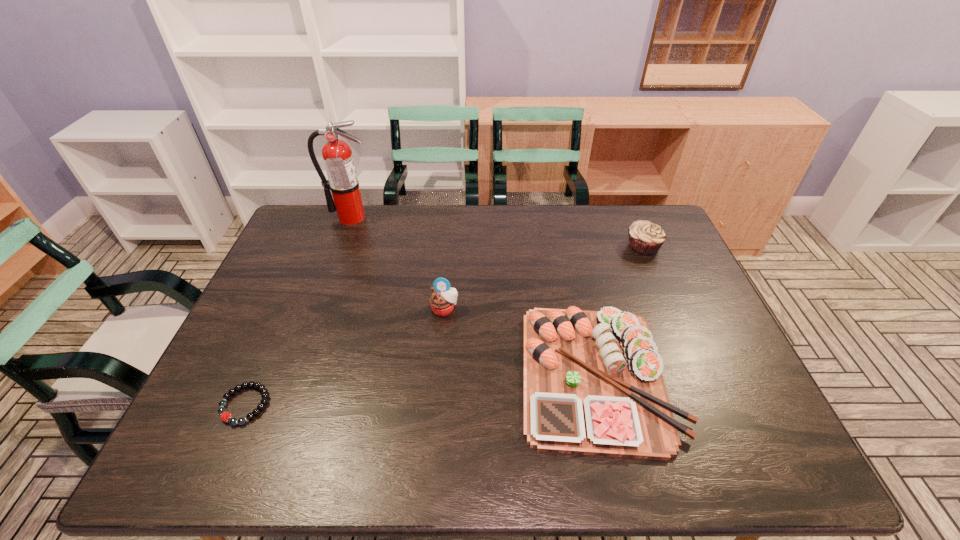
Where is `fire extinguisher`? The width and height of the screenshot is (960, 540). fire extinguisher is located at coordinates (337, 155).

Locate an element on the screen. This screenshot has height=540, width=960. the tallest object is located at coordinates (337, 155).

You are a GUI agent. You are given a task and a screenshot of the screen. Output one action in this format:
    pyautogui.click(x=<x>, y=<y>)
    Task: Click on the nearer muffin
    This screenshot has height=540, width=960.
    Given the screenshot: What is the action you would take?
    pyautogui.click(x=443, y=299)

The image size is (960, 540). In order to click on the left muffin in this screenshot , I will do `click(443, 299)`.

Where is `the fourth nearest object`? the fourth nearest object is located at coordinates (645, 238).

The height and width of the screenshot is (540, 960). Identify the location of the farther muffin. (645, 238).

The height and width of the screenshot is (540, 960). In order to click on platter in this screenshot , I will do `click(593, 381)`.

Identify the location of bracelet. (225, 416).

You are a GUI agent. You are given a task and a screenshot of the screen. Output one action in this format:
    pyautogui.click(x=<x>, y=<y>)
    Task: Click on the free space located 0.370m on the nozzle side of the fire extinguisher
    
    Given the screenshot: What is the action you would take?
    pyautogui.click(x=321, y=301)

Locate an element on the screen. The width and height of the screenshot is (960, 540). vacant space located 0.310m on the front-facing side of the left muffin is located at coordinates (436, 420).